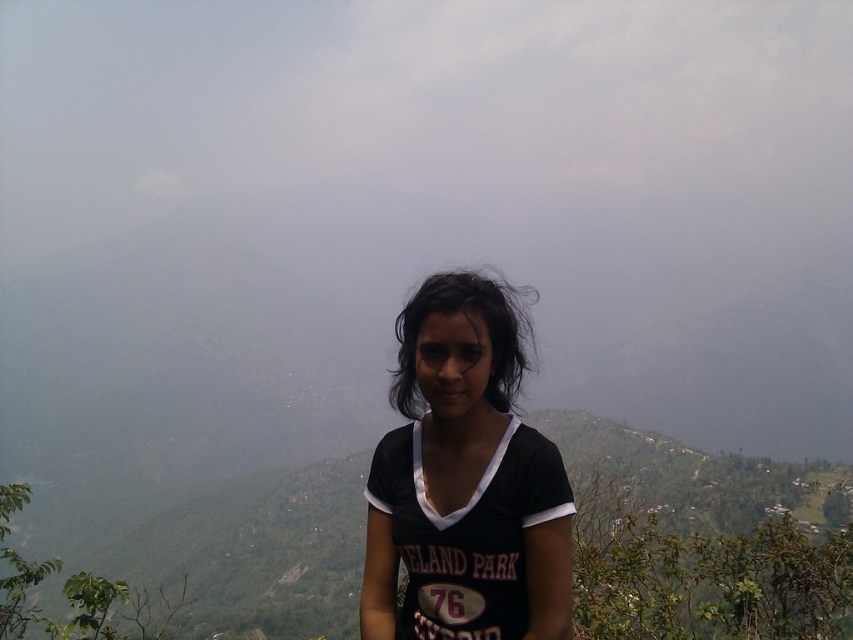
Between black matte shirt at center and black matte hair at center, which one has less height?

Standing shorter between the two is black matte shirt at center.

Does point (488, 572) come farther from viewer compared to point (434, 298)?

No, it is in front of (434, 298).

Is point (515, 544) positioned behind point (415, 378)?

No.

Find the location of `black matte shirt at center`. black matte shirt at center is located at coordinates (465, 481).